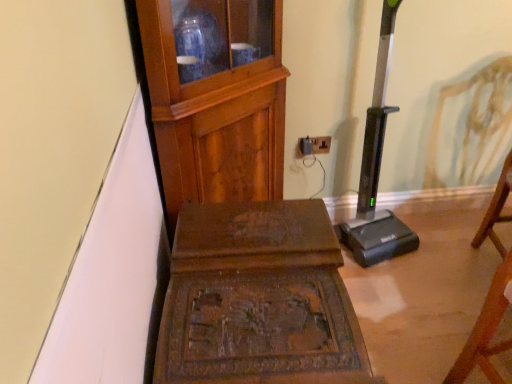
Identify the location of free space above carved wood table at center, marked as the second furniture in a left-to-right arrangement (from a real-world perspective). (256, 279).